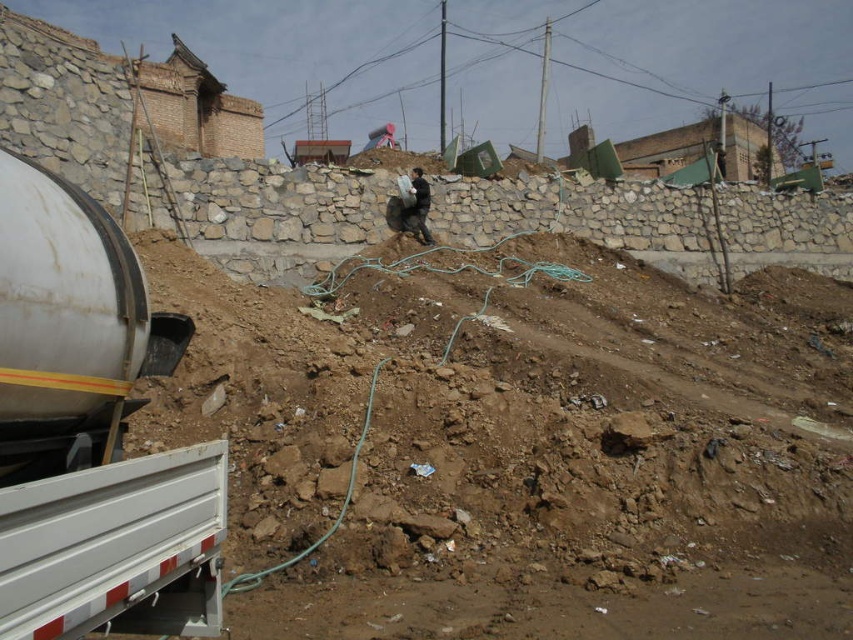
You are a construction worker who needs to place a tool on the ground. Considering the brown dirt at center and the dark gray fabric bag at upper center, which surface would allow the tool to be placed more securely?

The brown dirt at center has a greater height compared to the dark gray fabric bag at upper center, so placing the tool on the brown dirt at center would provide a more stable and secure surface due to its higher elevation and possibly firmer ground.

You are standing at the center of the construction site and want to locate the white metallic trailer truck at lower left. According to the coordinates, where exactly is it positioned?

The white metallic trailer truck at lower left is positioned at the 2D coordinates of point (115, 547).